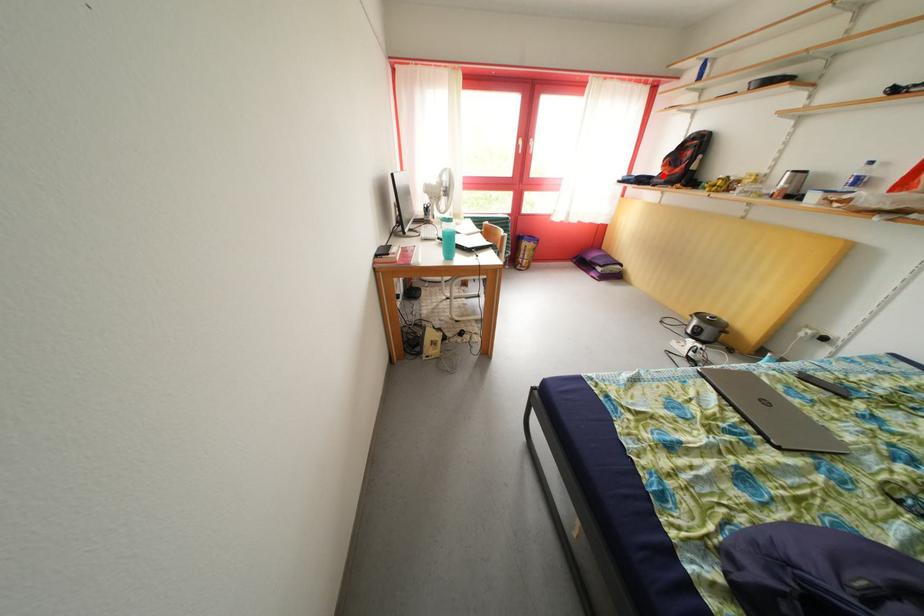
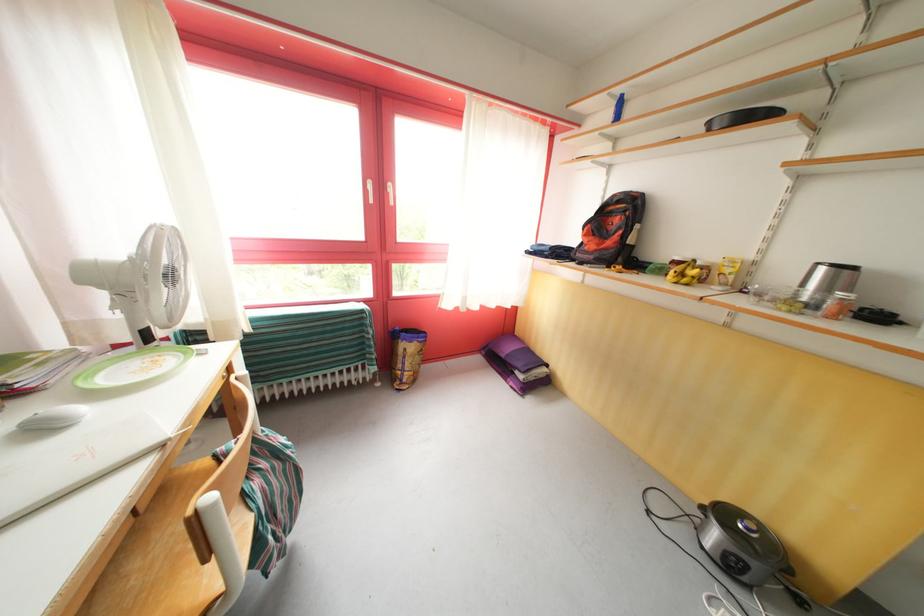
Question: I am providing you with two images of the same scene from different viewpoints. A red point is marked on the first image. At the location where the point appears in image 1, is it still visible in image 2?

Choices:
 (A) Yes
 (B) No

Answer: (A)